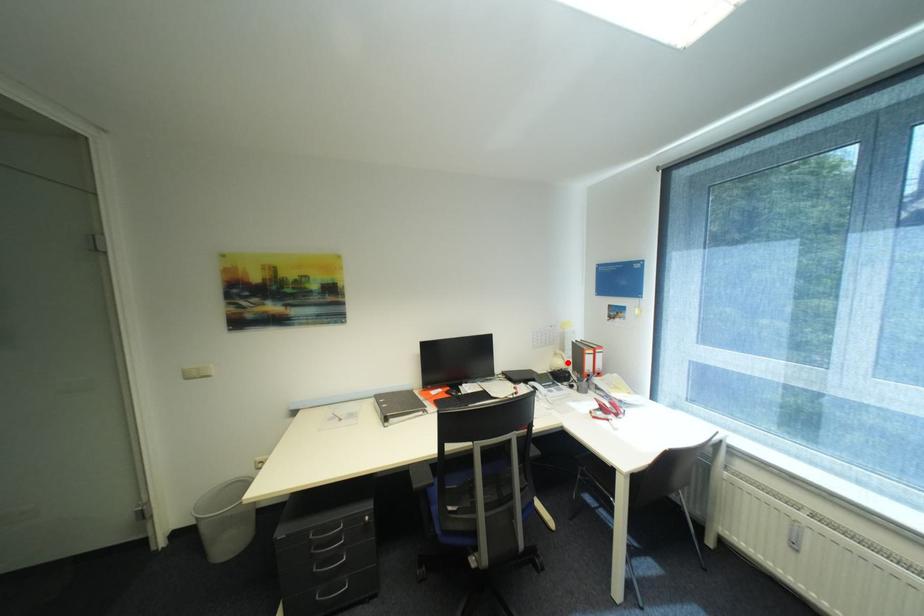
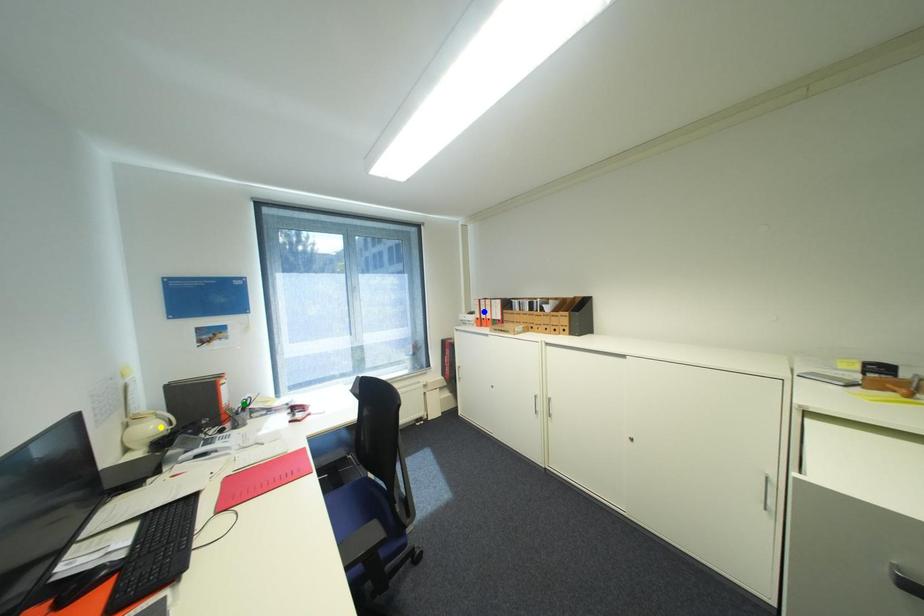
Question: I am providing you with two images of the same scene from different viewpoints. A red point is marked on the first image. You are given multiple points on the second image. In image 2, which mark is for the same physical point as the one in image 1?

Choices:
 (A) blue point
 (B) yellow point
 (C) green point

Answer: (B)